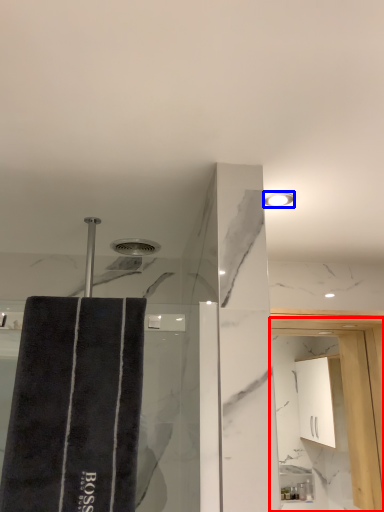
Question: Among these objects, which one is farthest to the camera, screen door (highlighted by a red box) or light fixture (highlighted by a blue box)?

Choices:
 (A) screen door
 (B) light fixture

Answer: (A)